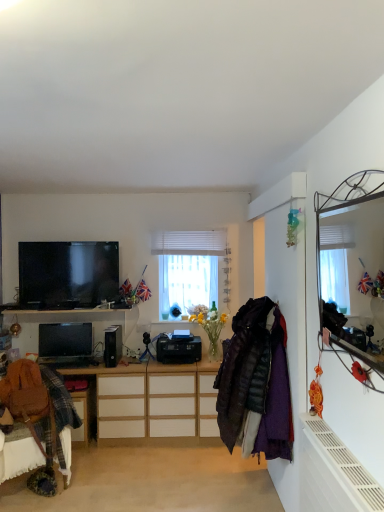
Describe the element at coordinates (352, 276) in the screenshot. I see `metallic mirror at upper right` at that location.

At what (x,y) coordinates should I click in order to perform the action: click on black plastic desktop computer at center. Please return your answer as a coordinate pair (x, y). This screenshot has height=512, width=384. Looking at the image, I should click on (65, 344).

I want to click on white textured blinds at center, so click(x=188, y=268).

Find the location of a particular element. Image resolution: width=384 pixels, height=512 pixels. black plastic speaker at center is located at coordinates (113, 345).

Describe the element at coordinates (256, 383) in the screenshot. The image size is (384, 512). I see `velvet purple coat at right` at that location.

You are a GUI agent. You are given a task and a screenshot of the screen. Output one action in this format:
    pyautogui.click(x=<x>, y=<y>)
    Task: Click on the metallic mirror at upper right
    
    Given the screenshot: What is the action you would take?
    pyautogui.click(x=352, y=276)

Is black plastic speaker at center surrounded by wooden cabinet at center?

Absolutely, black plastic speaker at center is inside wooden cabinet at center.

From a real-world perspective, which object stands above the other?

In real-world perspective, wooden cabinet at center is above.

Considering the points (123, 318) and (106, 362), which point is in front, point (123, 318) or point (106, 362)?

The point (106, 362) is more forward.

The image size is (384, 512). In order to click on cabinetry that appears on the left of black plastic speaker at center in this screenshot , I will do `click(71, 322)`.

Is point (115, 329) positioned before point (69, 306)?

No.

This screenshot has width=384, height=512. I want to click on speaker below the matte black tv at upper left (from the image's perspective), so click(x=113, y=345).

Is the depth of black plastic speaker at center less than that of matte black tv at upper left?

Yes.

Visually, is black plastic speaker at center positioned to the left or to the right of matte black tv at upper left?

From the image, it's evident that black plastic speaker at center is to the right of matte black tv at upper left.

Can you confirm if brown leather swivel chair at lower left is smaller than wooden cabinet at center?

Incorrect, brown leather swivel chair at lower left is not smaller in size than wooden cabinet at center.

Considering the positions of objects brown leather swivel chair at lower left and wooden cabinet at center in the image provided, who is more to the right, brown leather swivel chair at lower left or wooden cabinet at center?

From the viewer's perspective, wooden cabinet at center appears more on the right side.

Relative to wooden cabinet at center, is brown leather swivel chair at lower left in front or behind?

Visually, brown leather swivel chair at lower left is located in front of wooden cabinet at center.

Find the location of `cabinetry lying behind the brown leather swivel chair at lower left`. cabinetry lying behind the brown leather swivel chair at lower left is located at coordinates (71, 322).

Is wooden cabinet at center positioned with its back to white textured blinds at center?

No, white textured blinds at center is not at the back of wooden cabinet at center.

Locate an element on the screen. cabinetry below the white textured blinds at center (from the image's perspective) is located at coordinates [x=71, y=322].

Looking at this image, from the image's perspective, which is above, wooden cabinet at center or white textured blinds at center?

white textured blinds at center appears higher in the image.

Can you confirm if wooden cabinet at center is smaller than white textured blinds at center?

Incorrect, wooden cabinet at center is not smaller in size than white textured blinds at center.

Where is `window that appears above the brown leather swivel chair at lower left (from a real-world perspective)`? This screenshot has width=384, height=512. window that appears above the brown leather swivel chair at lower left (from a real-world perspective) is located at coordinates (188, 268).

Based on the photo, is brown leather swivel chair at lower left located within white textured blinds at center?

No, brown leather swivel chair at lower left is located outside of white textured blinds at center.

From a real-world perspective, is white textured blinds at center above or below brown leather swivel chair at lower left?

In terms of real-world spatial position, white textured blinds at center is above brown leather swivel chair at lower left.

From the image's perspective, who appears lower, white textured blinds at center or brown leather swivel chair at lower left?

brown leather swivel chair at lower left.

From a real-world perspective, which object stands above the other?

black plastic speaker at center, from a real-world perspective.

Is point (355, 482) closer to viewer compared to point (107, 356)?

Yes.

Considering the relative sizes of white matte radiator at lower right and black plastic speaker at center in the image provided, is white matte radiator at lower right shorter than black plastic speaker at center?

Incorrect, the height of white matte radiator at lower right does not fall short of that of black plastic speaker at center.

In the image, there is a black plastic speaker at center. Where is `radiator below it (from a real-world perspective)`? The width and height of the screenshot is (384, 512). radiator below it (from a real-world perspective) is located at coordinates (342, 470).

Is metallic mirror at upper right touching white matte radiator at lower right?

metallic mirror at upper right and white matte radiator at lower right are not in contact.

Does point (320, 452) lie in front of point (361, 510)?

No, it is not.

How many degrees apart are the facing directions of metallic mirror at upper right and white matte radiator at lower right?

0.522 degrees.

Between metallic mirror at upper right and white matte radiator at lower right, which one is positioned behind?

white matte radiator at lower right is further away from the camera.

What are the coordinates of `speaker that appears below the wooden cabinet at center (from a real-world perspective)` in the screenshot? It's located at (113, 345).

This screenshot has height=512, width=384. In order to click on television on the left of black plastic speaker at center in this screenshot , I will do `click(67, 274)`.

Estimate the real-world distances between objects in this image. Which object is further from metallic mirror at upper right, brown leather swivel chair at lower left or matte black tv at upper left?

Among the two, brown leather swivel chair at lower left is located further to metallic mirror at upper right.

Which object lies nearer to the anchor point black plastic speaker at center, brown leather swivel chair at lower left or matte black tv at upper left?

Based on the image, matte black tv at upper left appears to be nearer to black plastic speaker at center.

Based on their spatial positions, is black plastic speaker at center or black plastic desktop computer at center closer to white matte radiator at lower right?

Based on the image, black plastic speaker at center appears to be nearer to white matte radiator at lower right.

Considering their positions, is matte black tv at upper left positioned further to velvet purple coat at right than brown leather swivel chair at lower left?

matte black tv at upper left.

Based on their spatial positions, is brown leather swivel chair at lower left or velvet purple coat at right closer to black plastic speaker at center?

brown leather swivel chair at lower left is positioned closer to the anchor black plastic speaker at center.

Based on the photo, when comparing their distances from white matte radiator at lower right, does velvet purple coat at right or matte black tv at upper left seem further?

The object further to white matte radiator at lower right is matte black tv at upper left.

Estimate the real-world distances between objects in this image. Which object is closer to velvet purple coat at right, white textured blinds at center or matte black tv at upper left?

The object closer to velvet purple coat at right is white textured blinds at center.

Based on the photo, looking at the image, which one is located closer to wooden cabinet at center, matte black tv at upper left or white matte radiator at lower right?

matte black tv at upper left lies closer to wooden cabinet at center than the other object.

You are a GUI agent. You are given a task and a screenshot of the screen. Output one action in this format:
    pyautogui.click(x=<x>, y=<y>)
    Task: Click on the swivel chair between white matte radiator at lower right and wooden cabinet at center from front to back
    This screenshot has width=384, height=512.
    Given the screenshot: What is the action you would take?
    pyautogui.click(x=37, y=423)

Find the location of a particular element. The width and height of the screenshot is (384, 512). clothing between metallic mirror at upper right and black plastic desktop computer at center from front to back is located at coordinates (256, 383).

You are a GUI agent. You are given a task and a screenshot of the screen. Output one action in this format:
    pyautogui.click(x=<x>, y=<y>)
    Task: Click on the speaker located between velvet purple coat at right and white textured blinds at center in the depth direction
    
    Given the screenshot: What is the action you would take?
    pyautogui.click(x=113, y=345)

You are a GUI agent. You are given a task and a screenshot of the screen. Output one action in this format:
    pyautogui.click(x=<x>, y=<y>)
    Task: Click on the cabinetry between matte black tv at upper left and black plastic speaker at center in the vertical direction
    Image resolution: width=384 pixels, height=512 pixels.
    Given the screenshot: What is the action you would take?
    pyautogui.click(x=71, y=322)